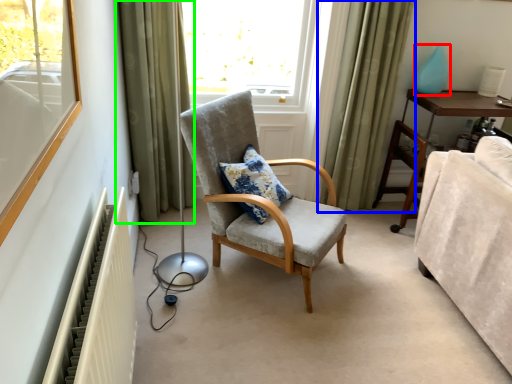
Question: Which object is the closest to the teal (highlighted by a red box)? Choose among these: curtain (highlighted by a blue box) or curtain (highlighted by a green box).

Choices:
 (A) curtain
 (B) curtain

Answer: (A)